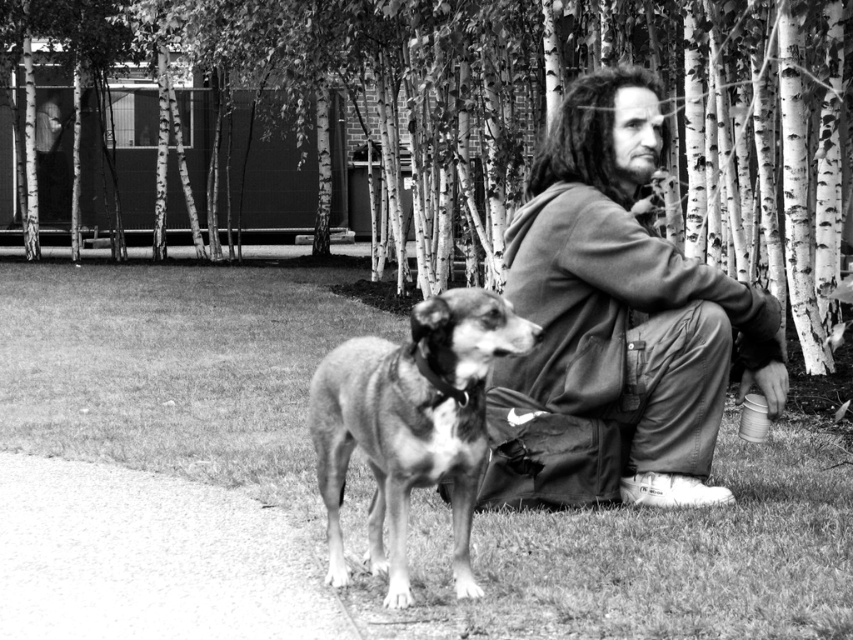
Question: Which object appears closest to the camera in this image?

Choices:
 (A) ripped denim jacket at center
 (B) spotted fur dog at center

Answer: (B)

Question: Which object is closer to the camera taking this photo?

Choices:
 (A) spotted fur dog at center
 (B) ripped denim jacket at center

Answer: (A)

Question: Does ripped denim jacket at center appear under spotted fur dog at center?

Choices:
 (A) yes
 (B) no

Answer: (B)

Question: Considering the relative positions of ripped denim jacket at center and spotted fur dog at center in the image provided, where is ripped denim jacket at center located with respect to spotted fur dog at center?

Choices:
 (A) left
 (B) right

Answer: (B)

Question: Where is ripped denim jacket at center located in relation to spotted fur dog at center in the image?

Choices:
 (A) left
 (B) right

Answer: (B)